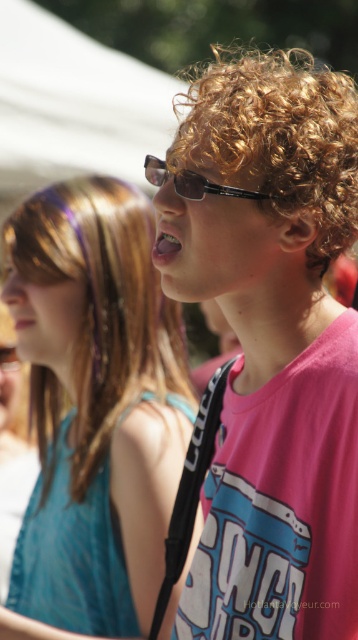
Question: Which point is closer to the camera?

Choices:
 (A) click(x=201, y=188)
 (B) click(x=279, y=92)
 (C) click(x=296, y=150)

Answer: (C)

Question: Does curly golden hair at center have a larger size compared to matte black sunglasses at center?

Choices:
 (A) yes
 (B) no

Answer: (A)

Question: Can you confirm if curly golden hair at center is positioned to the left of matte black sunglasses at center?

Choices:
 (A) yes
 (B) no

Answer: (B)

Question: Which point is closer to the camera taking this photo?

Choices:
 (A) (354, 520)
 (B) (191, 180)

Answer: (A)

Question: Considering the real-world distances, which object is farthest from the pink matte shirt at upper right?

Choices:
 (A) curly golden hair at center
 (B) matte black sunglasses at center
 (C) pink matte shirt at center

Answer: (A)

Question: Does pink matte shirt at center have a larger size compared to matte black sunglasses at center?

Choices:
 (A) yes
 (B) no

Answer: (A)